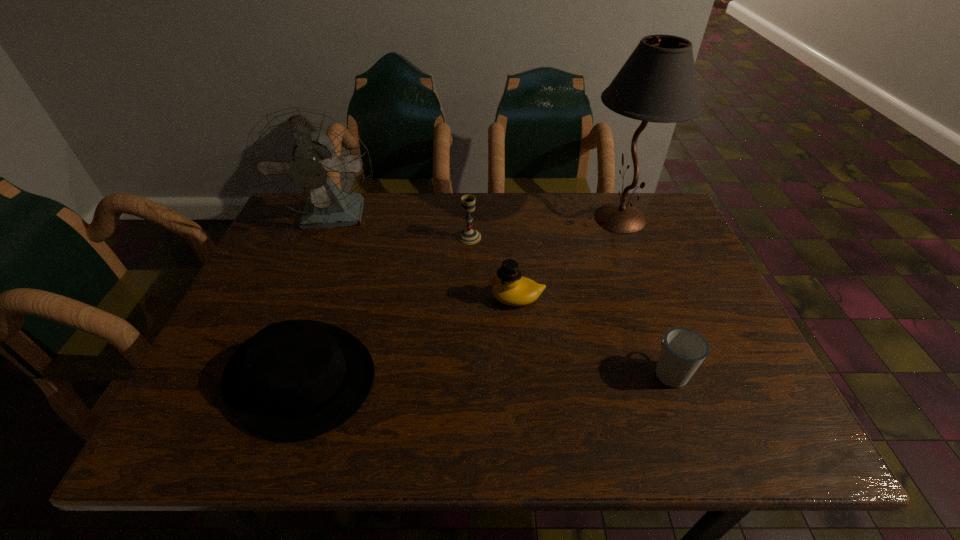
I want to click on free space located 0.350m in front of the second tallest object to blow air, so click(286, 344).

You are a GUI agent. You are given a task and a screenshot of the screen. Output one action in this format:
    pyautogui.click(x=<x>, y=<y>)
    Task: Click on the free spot located on the right of the chalice
    This screenshot has width=960, height=540.
    Given the screenshot: What is the action you would take?
    pyautogui.click(x=549, y=237)

You are a GUI agent. You are given a task and a screenshot of the screen. Output one action in this format:
    pyautogui.click(x=<x>, y=<y>)
    Task: Click on the free space located 0.280m on the front-facing side of the third object from right to left
    Image resolution: width=960 pixels, height=540 pixels.
    Given the screenshot: What is the action you would take?
    pyautogui.click(x=373, y=298)

Identify the location of vacant space located on the front-facing side of the third object from right to left. pos(422,298).

Identify the location of blank space located 0.260m on the front-facing side of the third object from right to left. [381, 298].

I want to click on vacant space located with a handle on the side of the cup, so click(643, 299).

You are a GUI agent. You are given a task and a screenshot of the screen. Output one action in this format:
    pyautogui.click(x=<x>, y=<y>)
    Task: Click on the vacant area situated 0.110m with a handle on the side of the cup
    
    Given the screenshot: What is the action you would take?
    pyautogui.click(x=649, y=315)

Find the location of `vacant area situated 0.060m with a handle on the side of the cup`. vacant area situated 0.060m with a handle on the side of the cup is located at coordinates (656, 332).

At what (x,y) coordinates should I click in order to perform the action: click on vacant position located 0.360m on the back of the fedora. Please return your answer as a coordinate pair (x, y). The image size is (960, 540). Looking at the image, I should click on (351, 227).

What are the coordinates of `table lamp at the far edge` in the screenshot? It's located at (658, 83).